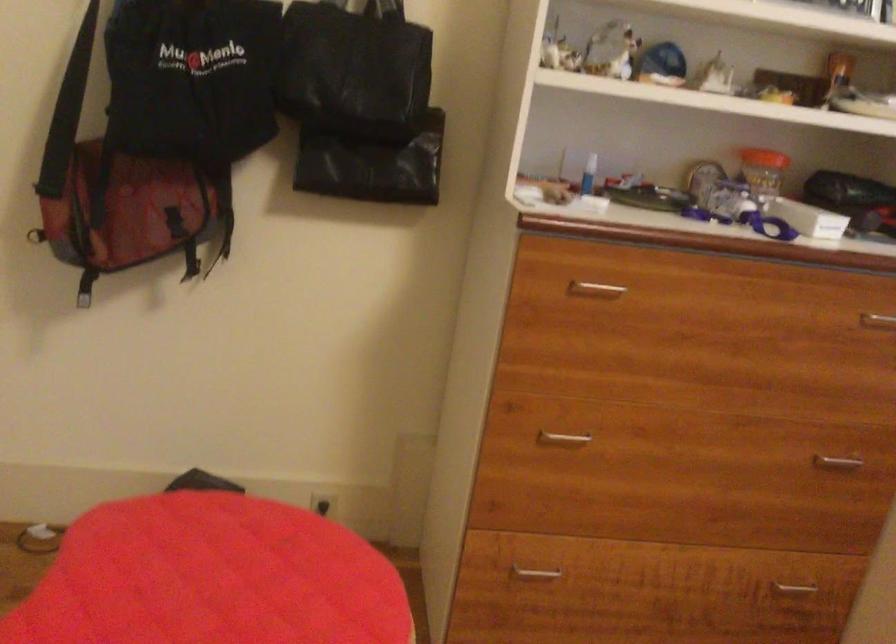
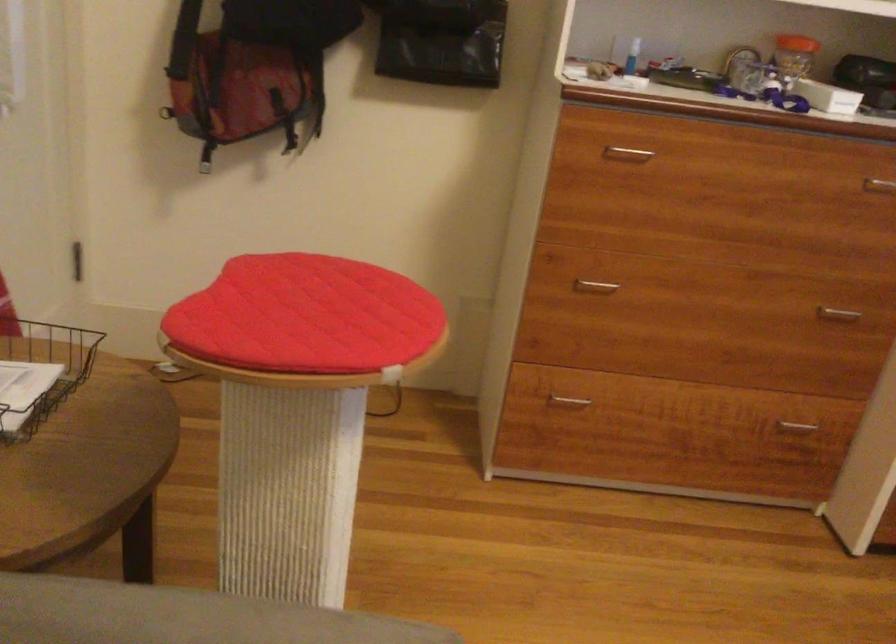
The point at [760,167] is marked in the first image. Where is the corresponding point in the second image?

(794, 53)